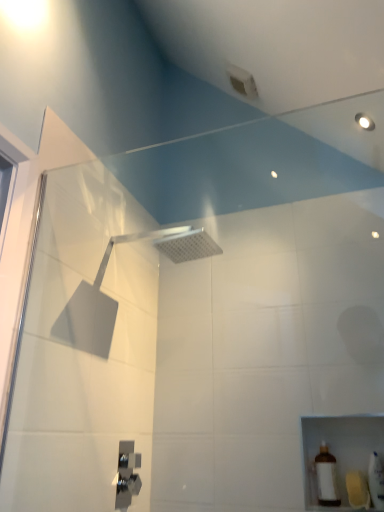
Question: From the image's perspective, is silver metallic shower head at upper center, marked as the second shower in a bottom-to-top arrangement, over satin nickel faucet at lower center, acting as the first shower starting from the bottom?

Choices:
 (A) yes
 (B) no

Answer: (A)

Question: Could you tell me if silver metallic shower head at upper center, arranged as the 2th shower when viewed from the left, is facing satin nickel faucet at lower center, placed as the second shower when sorted from top to bottom?

Choices:
 (A) yes
 (B) no

Answer: (B)

Question: From a real-world perspective, is silver metallic shower head at upper center, which is the first shower from right to left, on top of satin nickel faucet at lower center, marked as the first shower in a left-to-right arrangement?

Choices:
 (A) no
 (B) yes

Answer: (B)

Question: Can you see silver metallic shower head at upper center, marked as the second shower in a bottom-to-top arrangement, touching satin nickel faucet at lower center, which appears as the 2th shower when viewed from the right?

Choices:
 (A) yes
 (B) no

Answer: (B)

Question: Is silver metallic shower head at upper center, which is the first shower from right to left, located outside satin nickel faucet at lower center, which appears as the 2th shower when viewed from the right?

Choices:
 (A) yes
 (B) no

Answer: (A)

Question: Does silver metallic shower head at upper center, marked as the second shower in a bottom-to-top arrangement, have a greater width compared to satin nickel faucet at lower center, marked as the first shower in a left-to-right arrangement?

Choices:
 (A) yes
 (B) no

Answer: (A)

Question: Does brown matte bottle at lower right, placed as the 1th toiletry when sorted from left to right, have a greater width compared to silver metallic shower head at upper center, which is the first shower from right to left?

Choices:
 (A) yes
 (B) no

Answer: (B)

Question: From a real-world perspective, is brown matte bottle at lower right, placed as the 1th toiletry when sorted from left to right, positioned over silver metallic shower head at upper center, arranged as the 2th shower when viewed from the left, based on gravity?

Choices:
 (A) no
 (B) yes

Answer: (A)

Question: Is brown matte bottle at lower right, placed as the 1th toiletry when sorted from left to right, surrounding silver metallic shower head at upper center, which is the first shower from right to left?

Choices:
 (A) yes
 (B) no

Answer: (B)

Question: Is brown matte bottle at lower right, marked as the second toiletry in a right-to-left arrangement, closer to the viewer compared to silver metallic shower head at upper center, arranged as the 2th shower when viewed from the left?

Choices:
 (A) yes
 (B) no

Answer: (B)

Question: Can you confirm if brown matte bottle at lower right, placed as the 1th toiletry when sorted from left to right, is thinner than silver metallic shower head at upper center, arranged as the 2th shower when viewed from the left?

Choices:
 (A) no
 (B) yes

Answer: (B)

Question: Is brown matte bottle at lower right, placed as the 1th toiletry when sorted from left to right, completely or partially outside of silver metallic shower head at upper center, arranged as the 2th shower when viewed from the left?

Choices:
 (A) yes
 (B) no

Answer: (A)

Question: Can you confirm if white glossy bottle at lower right, acting as the first toiletry starting from the right, is wider than satin nickel faucet at lower center, acting as the first shower starting from the bottom?

Choices:
 (A) yes
 (B) no

Answer: (A)